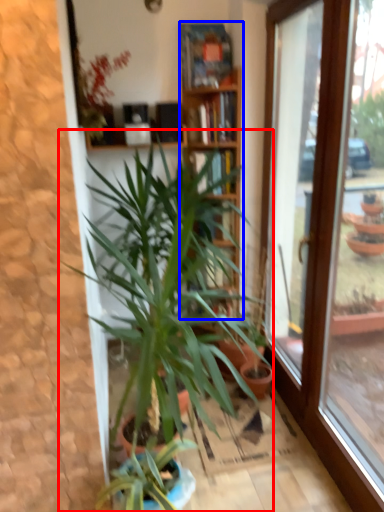
Question: Which of the following is the closest to the observer, houseplant (highlighted by a red box) or bookcase (highlighted by a blue box)?

Choices:
 (A) houseplant
 (B) bookcase

Answer: (A)